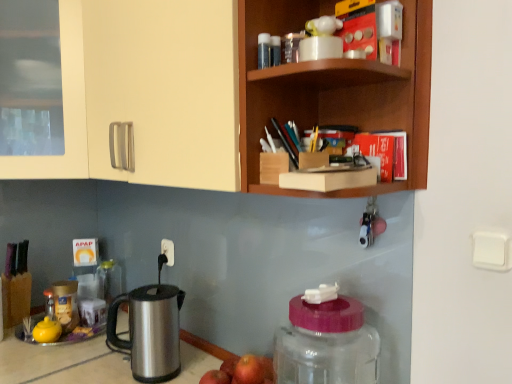
Question: From the image's perspective, is metallic silver jar at left, marked as the 1th bottle in a bottom-to-top arrangement, under stainless steel kettle at lower left?

Choices:
 (A) yes
 (B) no

Answer: (A)

Question: From the image's perspective, is metallic silver jar at left, the 1th bottle in the left-to-right sequence, located above stainless steel kettle at lower left?

Choices:
 (A) yes
 (B) no

Answer: (B)

Question: From a real-world perspective, is metallic silver jar at left, the 1th bottle in the left-to-right sequence, positioned over stainless steel kettle at lower left based on gravity?

Choices:
 (A) no
 (B) yes

Answer: (A)

Question: Is metallic silver jar at left, marked as the 1th bottle in a bottom-to-top arrangement, looking in the opposite direction of stainless steel kettle at lower left?

Choices:
 (A) no
 (B) yes

Answer: (A)

Question: Considering the relative sizes of metallic silver jar at left, the 1th bottle in the left-to-right sequence, and stainless steel kettle at lower left in the image provided, is metallic silver jar at left, the 1th bottle in the left-to-right sequence, taller than stainless steel kettle at lower left?

Choices:
 (A) yes
 (B) no

Answer: (B)

Question: Is metallic silver jar at left, marked as the 1th bottle in a bottom-to-top arrangement, to the right of stainless steel kettle at lower left from the viewer's perspective?

Choices:
 (A) no
 (B) yes

Answer: (A)

Question: Would you say wooden shelf at upper right is outside transparent plastic bottle at lower right, the third bottle from the back?

Choices:
 (A) no
 (B) yes

Answer: (B)

Question: From the image's perspective, does wooden shelf at upper right appear lower than transparent plastic bottle at lower right, the first bottle viewed from the front?

Choices:
 (A) no
 (B) yes

Answer: (A)

Question: Considering the relative sizes of wooden shelf at upper right and transparent plastic bottle at lower right, the 1th bottle from the right, in the image provided, is wooden shelf at upper right smaller than transparent plastic bottle at lower right, the 1th bottle from the right,?

Choices:
 (A) no
 (B) yes

Answer: (A)

Question: From a real-world perspective, does wooden shelf at upper right sit lower than transparent plastic bottle at lower right, the third bottle from the back?

Choices:
 (A) yes
 (B) no

Answer: (B)

Question: Can you confirm if wooden shelf at upper right is shorter than transparent plastic bottle at lower right, which is the 3th bottle from left to right?

Choices:
 (A) yes
 (B) no

Answer: (B)

Question: From a real-world perspective, is wooden shelf at upper right positioned over transparent plastic bottle at lower right, the 2th bottle positioned from the bottom, based on gravity?

Choices:
 (A) yes
 (B) no

Answer: (A)

Question: Is transparent plastic bottle at upper center, positioned as the second bottle in left-to-right order, oriented towards white plastic light switch at upper right?

Choices:
 (A) yes
 (B) no

Answer: (B)